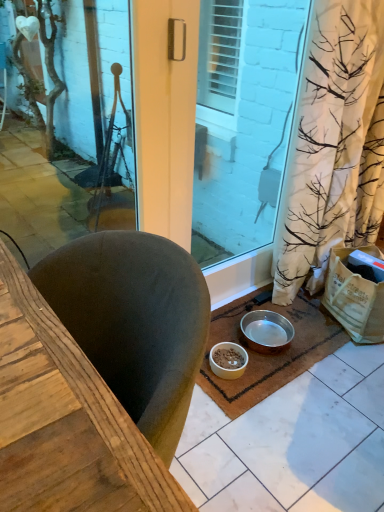
What are the coordinates of `free spot to the right of white matte bowl at lower center, arranged as the 2th bowl when viewed from the right` in the screenshot? It's located at (270, 374).